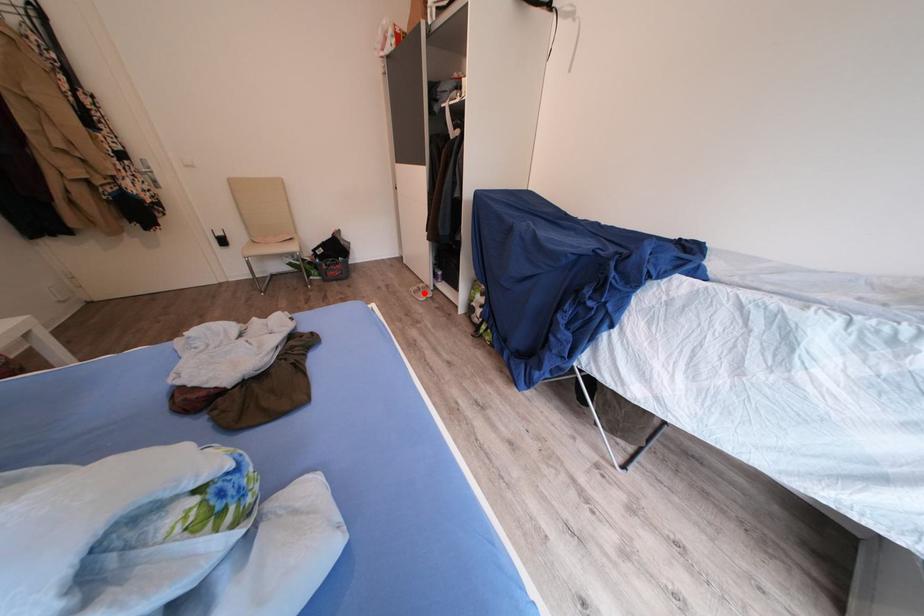
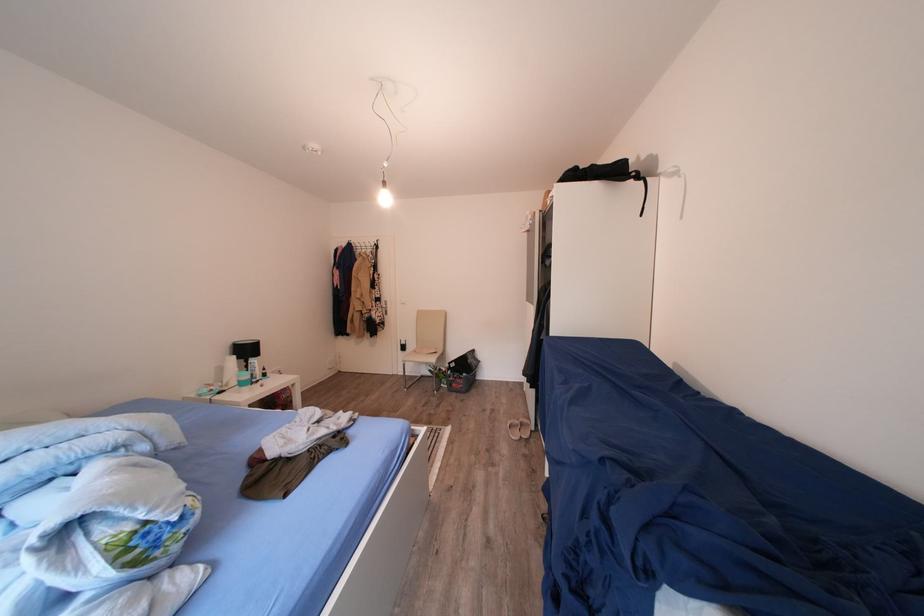
Locate, in the second image, the point that corresponds to the highlighted location in the first image.

(526, 427)